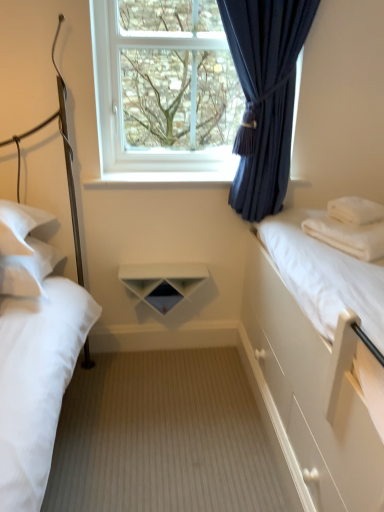
Question: Considering the relative positions of white matte bed at left, which is the second bed in right-to-left order, and white soft pillow at left, which ranks as the first pillow in left-to-right order, in the image provided, is white matte bed at left, which is the second bed in right-to-left order, to the left of white soft pillow at left, which ranks as the first pillow in left-to-right order, from the viewer's perspective?

Choices:
 (A) yes
 (B) no

Answer: (B)

Question: From the image's perspective, does white matte bed at left, which is the second bed in right-to-left order, appear higher than white soft pillow at left, which ranks as the first pillow in left-to-right order?

Choices:
 (A) yes
 (B) no

Answer: (B)

Question: From the image's perspective, does white matte bed at left, which appears as the 1th bed when viewed from the left, appear lower than white soft pillow at left, acting as the 3th pillow starting from the right?

Choices:
 (A) no
 (B) yes

Answer: (B)

Question: Is white matte bed at left, which is the second bed in right-to-left order, taller than white soft pillow at left, acting as the 3th pillow starting from the right?

Choices:
 (A) no
 (B) yes

Answer: (B)

Question: Is white matte bed at left, which is the second bed in right-to-left order, in contact with white soft pillow at left, acting as the 3th pillow starting from the right?

Choices:
 (A) yes
 (B) no

Answer: (B)

Question: Does point (206, 55) appear closer or farther from the camera than point (173, 174)?

Choices:
 (A) closer
 (B) farther

Answer: (A)

Question: From the image's perspective, is transparent glass window at upper center positioned above or below white glossy shelf at center?

Choices:
 (A) above
 (B) below

Answer: (A)

Question: In the image, is transparent glass window at upper center on the left side or the right side of white glossy shelf at center?

Choices:
 (A) left
 (B) right

Answer: (A)

Question: In the image, is transparent glass window at upper center positioned in front of or behind white glossy shelf at center?

Choices:
 (A) behind
 (B) front

Answer: (B)

Question: From the image's perspective, relative to white smooth bed at right, the second bed when ordered from left to right, is white matte shelf at center above or below?

Choices:
 (A) below
 (B) above

Answer: (B)

Question: Considering the positions of white matte shelf at center and white smooth bed at right, which is counted as the 1th bed, starting from the right, in the image, is white matte shelf at center taller or shorter than white smooth bed at right, which is counted as the 1th bed, starting from the right,?

Choices:
 (A) tall
 (B) short

Answer: (B)

Question: Considering the positions of white matte shelf at center and white smooth bed at right, the second bed when ordered from left to right, in the image, is white matte shelf at center wider or thinner than white smooth bed at right, the second bed when ordered from left to right,?

Choices:
 (A) wide
 (B) thin

Answer: (B)

Question: From a real-world perspective, is white matte shelf at center physically located above or below white smooth bed at right, the second bed when ordered from left to right?

Choices:
 (A) below
 (B) above

Answer: (A)

Question: From a real-world perspective, is white soft pillow at right, the 2th pillow when ordered from left to right, positioned above or below wooden floor at center?

Choices:
 (A) below
 (B) above

Answer: (B)

Question: Is point (357, 226) closer or farther from the camera than point (231, 509)?

Choices:
 (A) closer
 (B) farther

Answer: (B)